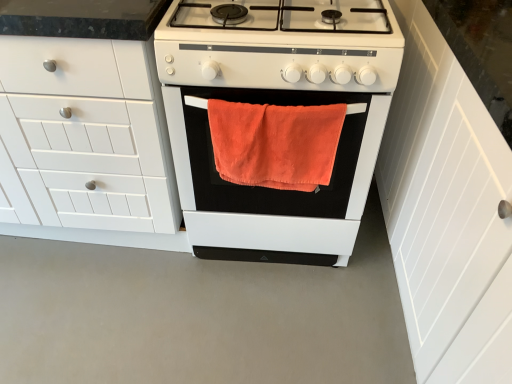
This screenshot has width=512, height=384. Describe the element at coordinates (88, 127) in the screenshot. I see `white matte cabinet at left, acting as the 2th cabinetry starting from the right` at that location.

What is the approximate width of orange cotton towel at center?

It is 5.79 centimeters.

Locate an element on the screen. white matte gas stove at center is located at coordinates (281, 45).

The height and width of the screenshot is (384, 512). Describe the element at coordinates (281, 45) in the screenshot. I see `white matte gas stove at center` at that location.

Where is `white wood cabinet at right, which is counted as the first cabinetry, starting from the right`? This screenshot has width=512, height=384. white wood cabinet at right, which is counted as the first cabinetry, starting from the right is located at coordinates (447, 212).

From the image's perspective, which one is positioned higher, white matte oven at center or white wood cabinet at right, marked as the 2th cabinetry in a left-to-right arrangement?

white matte oven at center is shown above in the image.

Which of these two, white matte oven at center or white wood cabinet at right, marked as the 2th cabinetry in a left-to-right arrangement, stands shorter?

white matte oven at center is shorter.

Does point (214, 68) come closer to viewer compared to point (394, 4)?

Yes, point (214, 68) is in front of point (394, 4).

From a real-world perspective, between white matte oven at center and white wood cabinet at right, which is counted as the first cabinetry, starting from the right, who is vertically lower?

white matte oven at center, from a real-world perspective.

Between white matte gas stove at center and orange cotton towel at center, which one has larger width?

With larger width is white matte gas stove at center.

Is white matte gas stove at center smaller than orange cotton towel at center?

No, white matte gas stove at center is not smaller than orange cotton towel at center.

Is white matte gas stove at center to the left of orange cotton towel at center from the viewer's perspective?

In fact, white matte gas stove at center is to the right of orange cotton towel at center.

Is white matte gas stove at center facing away from orange cotton towel at center?

No, white matte gas stove at center is not facing away from orange cotton towel at center.

From the image's perspective, which one is positioned higher, orange cotton towel at center or white matte oven at center?

From the image's view, white matte oven at center is above.

Are orange cotton towel at center and white matte oven at center making contact?

Absolutely, orange cotton towel at center is next to and touching white matte oven at center.

From a real-world perspective, who is located lower, orange cotton towel at center or white matte oven at center?

From a 3D spatial view, white matte oven at center is below.

Can we say orange cotton towel at center lies outside white matte oven at center?

No, orange cotton towel at center is not entirely external to white matte oven at center.

Which of these two, white matte cabinet at left, acting as the 2th cabinetry starting from the right, or white wood cabinet at right, marked as the 2th cabinetry in a left-to-right arrangement, is bigger?

Bigger between the two is white matte cabinet at left, acting as the 2th cabinetry starting from the right.

Is the position of white matte cabinet at left, arranged as the first cabinetry when viewed from the left, more distant than that of white wood cabinet at right, marked as the 2th cabinetry in a left-to-right arrangement?

That is True.

Does point (69, 173) lie in front of point (452, 358)?

No, it is behind (452, 358).

Based on the photo, is white matte gas stove at center not inside white wood cabinet at right, marked as the 2th cabinetry in a left-to-right arrangement?

Absolutely, white matte gas stove at center is external to white wood cabinet at right, marked as the 2th cabinetry in a left-to-right arrangement.

Is point (358, 59) closer or farther from the camera than point (397, 176)?

Clearly, point (358, 59) is closer to the camera than point (397, 176).

Are white matte gas stove at center and white wood cabinet at right, which is counted as the first cabinetry, starting from the right, far apart?

white matte gas stove at center is near white wood cabinet at right, which is counted as the first cabinetry, starting from the right, not far away.

Between point (459, 283) and point (357, 116), which one is positioned in front?

Positioned in front is point (459, 283).

Is orange cotton towel at center at the back of white wood cabinet at right, marked as the 2th cabinetry in a left-to-right arrangement?

Yes, white wood cabinet at right, marked as the 2th cabinetry in a left-to-right arrangement, is positioned with its back facing orange cotton towel at center.

Is there a large distance between white wood cabinet at right, marked as the 2th cabinetry in a left-to-right arrangement, and orange cotton towel at center?

white wood cabinet at right, marked as the 2th cabinetry in a left-to-right arrangement, is near orange cotton towel at center, not far away.

Can you confirm if white wood cabinet at right, marked as the 2th cabinetry in a left-to-right arrangement, is wider than orange cotton towel at center?

Yes.

Considering the sizes of objects white wood cabinet at right, marked as the 2th cabinetry in a left-to-right arrangement, and white matte gas stove at center in the image provided, who is smaller, white wood cabinet at right, marked as the 2th cabinetry in a left-to-right arrangement, or white matte gas stove at center?

white matte gas stove at center.

From a real-world perspective, who is located higher, white wood cabinet at right, which is counted as the first cabinetry, starting from the right, or white matte gas stove at center?

white matte gas stove at center is physically above.

Is point (426, 315) positioned in front of point (158, 49)?

No, (426, 315) is behind (158, 49).

Is white wood cabinet at right, marked as the 2th cabinetry in a left-to-right arrangement, to the left or to the right of white matte gas stove at center in the image?

From the image, it's evident that white wood cabinet at right, marked as the 2th cabinetry in a left-to-right arrangement, is to the right of white matte gas stove at center.

In order to click on the 2nd cabinetry directly above the white matte oven at center (from a real-world perspective) in this screenshot , I will do `click(447, 212)`.

Identify the location of gas stove above the orange cotton towel at center (from the image's perspective). (281, 45).

Estimate the real-world distances between objects in this image. Which object is further from orange cotton towel at center, white matte cabinet at left, acting as the 2th cabinetry starting from the right, or white wood cabinet at right, which is counted as the first cabinetry, starting from the right?

white wood cabinet at right, which is counted as the first cabinetry, starting from the right, is positioned further to the anchor orange cotton towel at center.

Considering their positions, is white wood cabinet at right, which is counted as the first cabinetry, starting from the right, positioned further to white matte gas stove at center than white matte oven at center?

white wood cabinet at right, which is counted as the first cabinetry, starting from the right, lies further to white matte gas stove at center than the other object.

Estimate the real-world distances between objects in this image. Which object is closer to orange cotton towel at center, white matte cabinet at left, acting as the 2th cabinetry starting from the right, or white matte oven at center?

white matte oven at center is positioned closer to the anchor orange cotton towel at center.

When comparing their distances from white wood cabinet at right, marked as the 2th cabinetry in a left-to-right arrangement, does white matte oven at center or orange cotton towel at center seem closer?

orange cotton towel at center.

When comparing their distances from white matte oven at center, does white wood cabinet at right, which is counted as the first cabinetry, starting from the right, or white matte gas stove at center seem closer?

Among the two, white matte gas stove at center is located nearer to white matte oven at center.

Looking at the image, which one is located closer to white matte oven at center, orange cotton towel at center or white matte gas stove at center?

orange cotton towel at center lies closer to white matte oven at center than the other object.

Based on their spatial positions, is orange cotton towel at center or white wood cabinet at right, marked as the 2th cabinetry in a left-to-right arrangement, further from white matte cabinet at left, arranged as the first cabinetry when viewed from the left?

Among the two, white wood cabinet at right, marked as the 2th cabinetry in a left-to-right arrangement, is located further to white matte cabinet at left, arranged as the first cabinetry when viewed from the left.

From the image, which object appears to be nearer to white wood cabinet at right, which is counted as the first cabinetry, starting from the right, orange cotton towel at center or white matte oven at center?

orange cotton towel at center is closer to white wood cabinet at right, which is counted as the first cabinetry, starting from the right.

Where is `appliance between white matte cabinet at left, arranged as the first cabinetry when viewed from the left, and white wood cabinet at right, marked as the 2th cabinetry in a left-to-right arrangement, from left to right`? The height and width of the screenshot is (384, 512). appliance between white matte cabinet at left, arranged as the first cabinetry when viewed from the left, and white wood cabinet at right, marked as the 2th cabinetry in a left-to-right arrangement, from left to right is located at coordinates (276, 121).

I want to click on oven between white matte cabinet at left, acting as the 2th cabinetry starting from the right, and white matte gas stove at center, in the horizontal direction, so click(x=270, y=188).

Where is `gas stove located between white matte oven at center and white wood cabinet at right, which is counted as the first cabinetry, starting from the right, in the left-right direction`? This screenshot has width=512, height=384. gas stove located between white matte oven at center and white wood cabinet at right, which is counted as the first cabinetry, starting from the right, in the left-right direction is located at coordinates (281, 45).

Where is `gas stove between orange cotton towel at center and white wood cabinet at right, which is counted as the first cabinetry, starting from the right, in the horizontal direction`? This screenshot has height=384, width=512. gas stove between orange cotton towel at center and white wood cabinet at right, which is counted as the first cabinetry, starting from the right, in the horizontal direction is located at coordinates (281, 45).